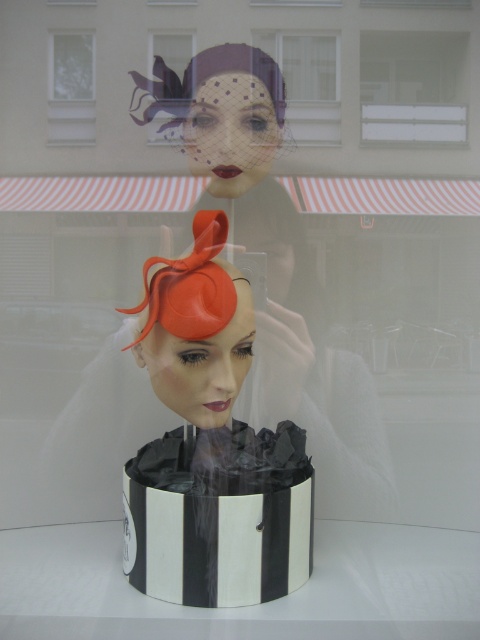
You are a customer in a hat shop. You want to buy a hat that is wider than the other. Which one should you choose between the orange matte fascinator at center and the matte black hat at center?

The matte black hat at center is wider than the orange matte fascinator at center, so you should choose the matte black hat at center.

You are a customer looking at the shop window. You see the matte black hat at center and the transparent glass window at upper left. Which object is nearer to you?

The matte black hat at center is closer to the viewer than the transparent glass window at upper left.